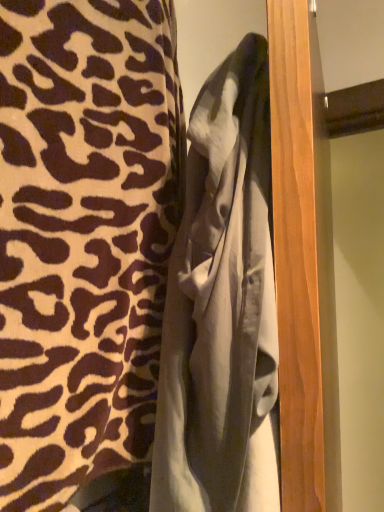
Identify the location of leopard print fabric at center. Image resolution: width=384 pixels, height=512 pixels. (83, 237).

This screenshot has height=512, width=384. Describe the element at coordinates (83, 237) in the screenshot. I see `leopard print fabric at center` at that location.

What is the approximate height of leopard print fabric at center?

The height of leopard print fabric at center is 33.85 inches.

In order to click on gray cotton bathrobe at center in this screenshot , I will do `click(222, 308)`.

Measure the distance between gray cotton bathrobe at center and camera.

gray cotton bathrobe at center and camera are 16.56 inches apart.

This screenshot has width=384, height=512. What do you see at coordinates (222, 308) in the screenshot? I see `gray cotton bathrobe at center` at bounding box center [222, 308].

Where is `leopard print fabric at center`? The width and height of the screenshot is (384, 512). leopard print fabric at center is located at coordinates (83, 237).

Would you say leopard print fabric at center is to the left or to the right of gray cotton bathrobe at center in the picture?

leopard print fabric at center is positioned on gray cotton bathrobe at center's left side.

Which is behind, leopard print fabric at center or gray cotton bathrobe at center?

gray cotton bathrobe at center is more distant.

Is point (70, 184) positioned in front of point (237, 169)?

No, it is behind (237, 169).

From the image's perspective, is leopard print fabric at center over gray cotton bathrobe at center?

Yes, from the image's perspective, leopard print fabric at center is over gray cotton bathrobe at center.

Looking at this image, from a real-world perspective, which object stands above the other?

leopard print fabric at center.

Considering the sizes of objects leopard print fabric at center and gray cotton bathrobe at center in the image provided, who is wider, leopard print fabric at center or gray cotton bathrobe at center?

With larger width is leopard print fabric at center.

Between leopard print fabric at center and gray cotton bathrobe at center, which one has more height?

Standing taller between the two is leopard print fabric at center.

Who is smaller, leopard print fabric at center or gray cotton bathrobe at center?

gray cotton bathrobe at center is smaller.

Is leopard print fabric at center inside or outside of gray cotton bathrobe at center?

leopard print fabric at center cannot be found inside gray cotton bathrobe at center.

Is leopard print fabric at center with gray cotton bathrobe at center?

No, leopard print fabric at center is not with gray cotton bathrobe at center.

Is leopard print fabric at center looking in the opposite direction of gray cotton bathrobe at center?

Correct, leopard print fabric at center is looking away from gray cotton bathrobe at center.

You are a GUI agent. You are given a task and a screenshot of the screen. Output one action in this format:
    pyautogui.click(x=<x>, y=<y>)
    Task: Click on the bathrobe below the leopard print fabric at center (from a real-world perspective)
    The width and height of the screenshot is (384, 512).
    Given the screenshot: What is the action you would take?
    pyautogui.click(x=222, y=308)

Considering the positions of objects gray cotton bathrobe at center and leopard print fabric at center in the image provided, who is more to the right, gray cotton bathrobe at center or leopard print fabric at center?

From the viewer's perspective, gray cotton bathrobe at center appears more on the right side.

Consider the image. Relative to leopard print fabric at center, is gray cotton bathrobe at center in front or behind?

gray cotton bathrobe at center is behind leopard print fabric at center.

Between point (201, 290) and point (18, 114), which one is positioned in front?

Positioned in front is point (18, 114).

From the image's perspective, relative to leopard print fabric at center, is gray cotton bathrobe at center above or below?

Clearly, from the image's perspective, gray cotton bathrobe at center is below leopard print fabric at center.

Consider the image. From a real-world perspective, is gray cotton bathrobe at center beneath leopard print fabric at center?

Yes.

Is gray cotton bathrobe at center thinner than leopard print fabric at center?

Yes.

In the scene shown: Who is taller, gray cotton bathrobe at center or leopard print fabric at center?

With more height is leopard print fabric at center.

Considering the relative sizes of gray cotton bathrobe at center and leopard print fabric at center in the image provided, is gray cotton bathrobe at center smaller than leopard print fabric at center?

Indeed, gray cotton bathrobe at center has a smaller size compared to leopard print fabric at center.

Is gray cotton bathrobe at center situated inside leopard print fabric at center or outside?

gray cotton bathrobe at center is contained in leopard print fabric at center.

Are gray cotton bathrobe at center and leopard print fabric at center located far from each other?

No, gray cotton bathrobe at center is in close proximity to leopard print fabric at center.

Is gray cotton bathrobe at center aimed at leopard print fabric at center?

Yes, gray cotton bathrobe at center is facing leopard print fabric at center.

What's the angular difference between gray cotton bathrobe at center and leopard print fabric at center's facing directions?

They differ by 153 degrees in their facing directions.

Where is `bathrobe on the right of leopard print fabric at center`? bathrobe on the right of leopard print fabric at center is located at coordinates (222, 308).

In order to click on curtain on the left of gray cotton bathrobe at center in this screenshot , I will do `click(83, 237)`.

There is a gray cotton bathrobe at center. Find the location of `curtain above it (from a real-world perspective)`. curtain above it (from a real-world perspective) is located at coordinates (83, 237).